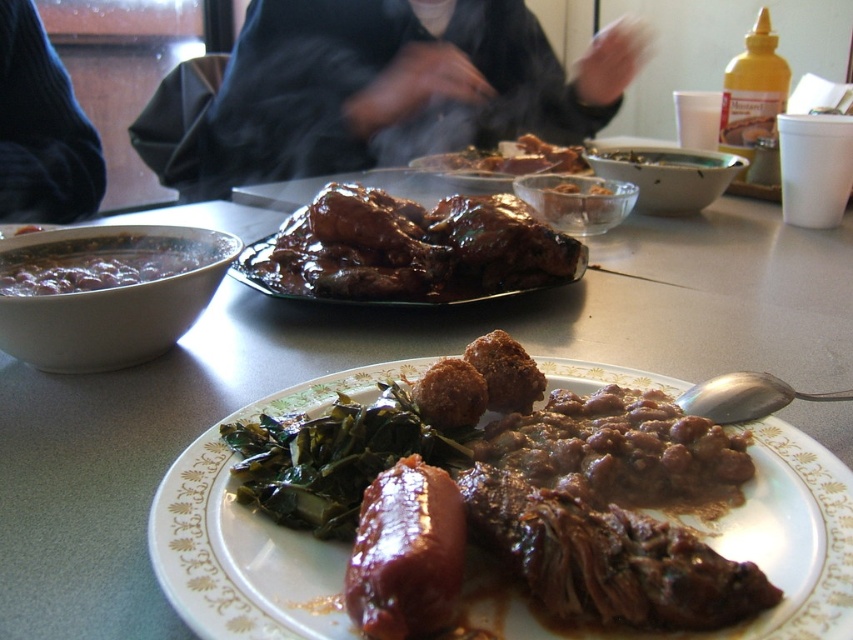
Question: Which point is farther to the camera?

Choices:
 (A) brown glazed chicken leg at center
 (B) black matte jacket at upper center
 (C) brown matte plate at center

Answer: (B)

Question: From the image, what is the correct spatial relationship of black fabric at upper left in relation to brown matte beans at left?

Choices:
 (A) above
 (B) below

Answer: (A)

Question: Can you confirm if brown matte beans at left is bigger than brown glazed chicken leg at center?

Choices:
 (A) no
 (B) yes

Answer: (A)

Question: Which point appears farthest from the camera in this image?

Choices:
 (A) (128, 243)
 (B) (421, 497)
 (C) (347, 296)
 (D) (305, 81)

Answer: (D)

Question: Which object is closer to the camera taking this photo?

Choices:
 (A) brown glazed chicken leg at center
 (B) glossy brown sausage at center

Answer: (B)

Question: Does glossy brown sausage at center have a greater width compared to brown glazed chicken leg at center?

Choices:
 (A) no
 (B) yes

Answer: (A)